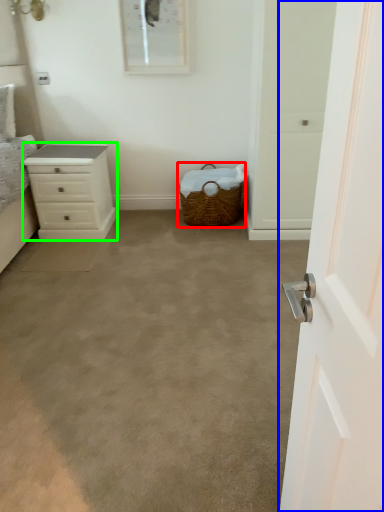
Question: Estimate the real-world distances between objects in this image. Which object is farther from picnic basket (highlighted by a red box), door (highlighted by a blue box) or chest of drawers (highlighted by a green box)?

Choices:
 (A) door
 (B) chest of drawers

Answer: (A)